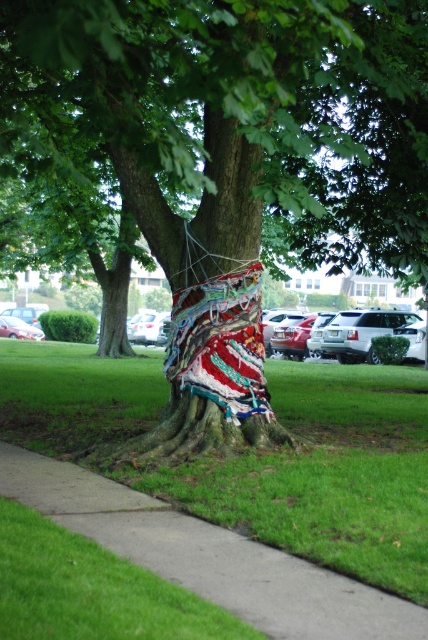
What do you see at coordinates (240, 122) in the screenshot? I see `knitted fabric tree at center` at bounding box center [240, 122].

Which is behind, point (410, 209) or point (318, 464)?

The point (410, 209) is more distant.

At what (x,y) coordinates should I click in order to perform the action: click on knitted fabric tree at center. Please return your answer as a coordinate pair (x, y). Image resolution: width=428 pixels, height=640 pixels. Looking at the image, I should click on (240, 122).